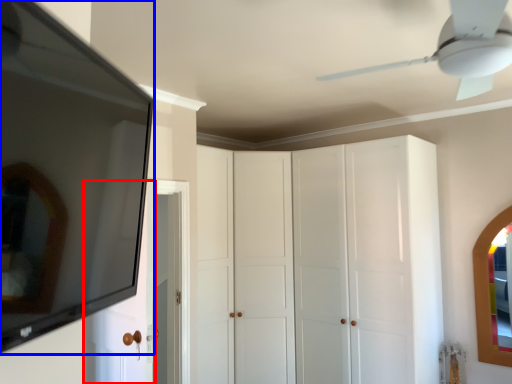
Question: Which object appears closest to the camera in this image, door (highlighted by a red box) or mirror (highlighted by a blue box)?

Choices:
 (A) door
 (B) mirror

Answer: (B)